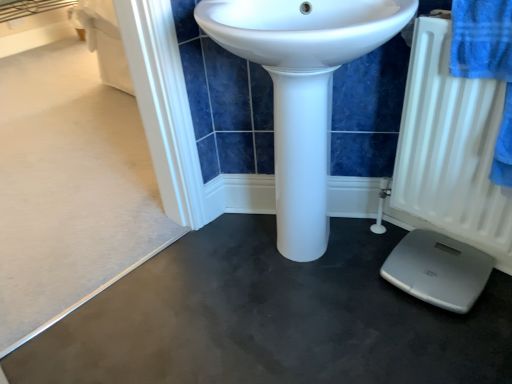
Locate an element on the screen. The height and width of the screenshot is (384, 512). white matte radiator at right is located at coordinates (449, 150).

Describe the element at coordinates (449, 150) in the screenshot. This screenshot has height=384, width=512. I see `white matte radiator at right` at that location.

The width and height of the screenshot is (512, 384). Describe the element at coordinates (302, 89) in the screenshot. I see `white glossy sink at center` at that location.

Locate an element on the screen. This screenshot has width=512, height=384. white glossy sink at center is located at coordinates (302, 89).

This screenshot has width=512, height=384. Identify the location of white matte radiator at right. (449, 150).

Between white matte radiator at right and white glossy sink at center, which one appears on the left side from the viewer's perspective?

Positioned to the left is white glossy sink at center.

Does white matte radiator at right lie behind white glossy sink at center?

Yes, the depth of white matte radiator at right is greater than that of white glossy sink at center.

Which point is more distant from viewer, (425, 226) or (349, 51)?

The point (425, 226) is farther from the camera.

From the image's perspective, who appears lower, white matte radiator at right or white glossy sink at center?

white matte radiator at right is shown below in the image.

From a real-world perspective, which is physically above, white matte radiator at right or white glossy sink at center?

white matte radiator at right, from a real-world perspective.

Can you confirm if white matte radiator at right is wider than white glossy sink at center?

In fact, white matte radiator at right might be narrower than white glossy sink at center.

Considering the relative sizes of white matte radiator at right and white glossy sink at center in the image provided, is white matte radiator at right shorter than white glossy sink at center?

Indeed, white matte radiator at right has a lesser height compared to white glossy sink at center.

Looking at this image, considering the sizes of white matte radiator at right and white glossy sink at center in the image, is white matte radiator at right bigger or smaller than white glossy sink at center?

Considering their sizes, white matte radiator at right takes up less space than white glossy sink at center.

Is white matte radiator at right inside the boundaries of white glossy sink at center, or outside?

white matte radiator at right exists outside the volume of white glossy sink at center.

Is white matte radiator at right next to white glossy sink at center and touching it?

There is a gap between white matte radiator at right and white glossy sink at center.

Is white matte radiator at right facing away from white glossy sink at center?

white matte radiator at right does not have its back to white glossy sink at center.

How many degrees apart are the facing directions of white matte radiator at right and white glossy sink at center?

There is a 33.1-degree angle between the facing directions of white matte radiator at right and white glossy sink at center.

Locate an element on the screen. The image size is (512, 384). radiator that is below the white glossy sink at center (from the image's perspective) is located at coordinates (449, 150).

Is white glossy sink at center to the right of white matte radiator at right from the viewer's perspective?

No, white glossy sink at center is not to the right of white matte radiator at right.

Considering the positions of objects white glossy sink at center and white matte radiator at right in the image provided, who is in front, white glossy sink at center or white matte radiator at right?

white glossy sink at center.

Is point (219, 33) closer or farther from the camera than point (459, 140)?

Point (219, 33) is positioned closer to the camera compared to point (459, 140).

From the image's perspective, does white glossy sink at center appear lower than white matte radiator at right?

No.

From a real-world perspective, is white glossy sink at center beneath white matte radiator at right?

Yes, from a real-world perspective, white glossy sink at center is beneath white matte radiator at right.

Which of these two, white glossy sink at center or white matte radiator at right, is wider?

white glossy sink at center is wider.

Who is shorter, white glossy sink at center or white matte radiator at right?

With less height is white matte radiator at right.

Who is smaller, white glossy sink at center or white matte radiator at right?

With smaller size is white matte radiator at right.

Is white glossy sink at center inside or outside of white matte radiator at right?

white glossy sink at center is not enclosed by white matte radiator at right.

Does white glossy sink at center touch white matte radiator at right?

No, white glossy sink at center is not touching white matte radiator at right.

Is white glossy sink at center oriented away from white matte radiator at right?

No, white glossy sink at center is not facing the opposite direction of white matte radiator at right.

Measure the distance between white glossy sink at center and white matte radiator at right.

The distance of white glossy sink at center from white matte radiator at right is 13.31 inches.

The height and width of the screenshot is (384, 512). I want to click on radiator behind the white glossy sink at center, so click(x=449, y=150).

Locate an element on the screen. The height and width of the screenshot is (384, 512). sink on the left of white matte radiator at right is located at coordinates coord(302,89).

You are a GUI agent. You are given a task and a screenshot of the screen. Output one action in this format:
    pyautogui.click(x=<x>, y=<y>)
    Task: Click on the sink directly beneath the white matte radiator at right (from a real-world perspective)
    Image resolution: width=512 pixels, height=384 pixels.
    Given the screenshot: What is the action you would take?
    pyautogui.click(x=302, y=89)